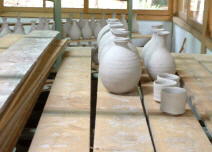
Where is `windows`? windows is located at coordinates (143, 5), (201, 8), (109, 3), (72, 3), (29, 3).